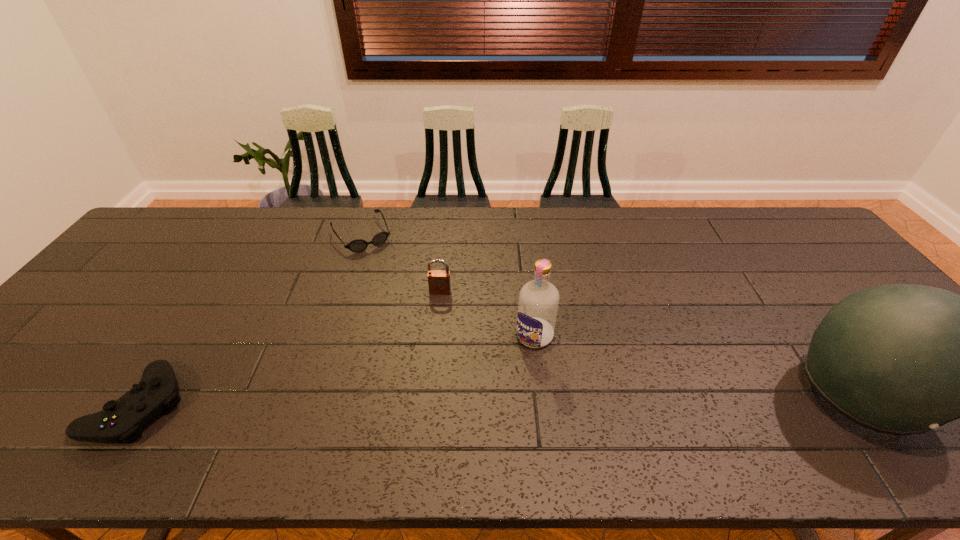
Identify the location of object that is the nearest to the rightmost object. The height and width of the screenshot is (540, 960). (537, 308).

Where is `object that is the second closest to the second shortest object`? The height and width of the screenshot is (540, 960). object that is the second closest to the second shortest object is located at coordinates (438, 280).

The height and width of the screenshot is (540, 960). Find the location of `free point that satisfies the following two spatial constraints: 1. on the back side of the leftmost object; 2. on the left side of the vodka`. free point that satisfies the following two spatial constraints: 1. on the back side of the leftmost object; 2. on the left side of the vodka is located at coordinates coord(183,336).

What are the coordinates of `free space that satisfies the following two spatial constraints: 1. on the back side of the fourth shortest object; 2. on the right side of the fourth tallest object` in the screenshot? It's located at (183, 336).